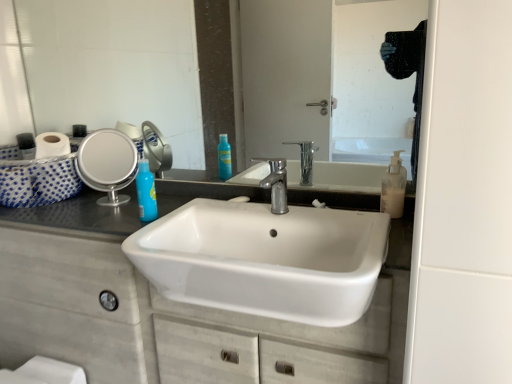
Identify the location of free location to the right of polished chrome faucet at center. This screenshot has width=512, height=384. (333, 214).